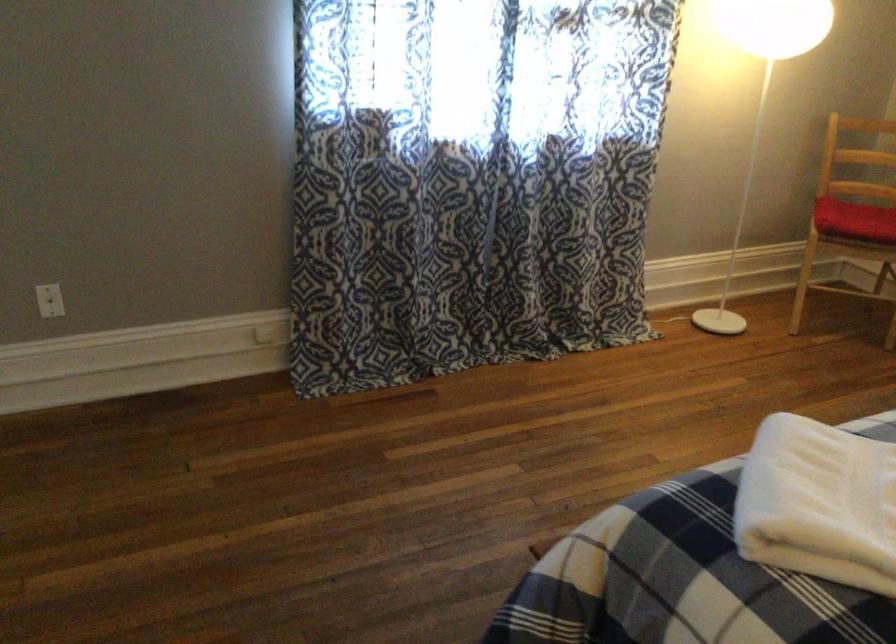
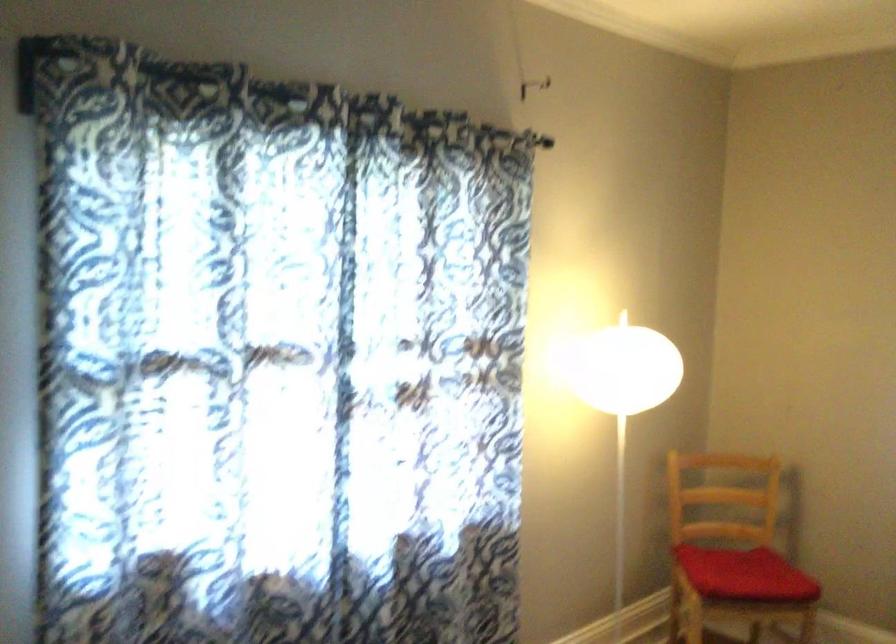
Question: Which direction would the cameraman need to move to produce the second image? Reply with the corresponding letter.

Choices:
 (A) Left
 (B) Right
 (C) Forward
 (D) Backward

Answer: (C)